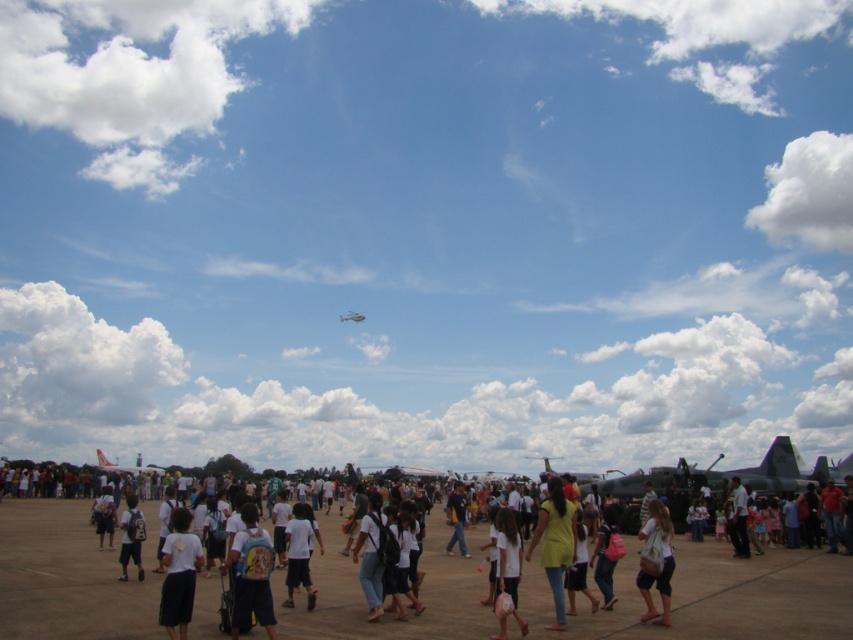
You are a photographer at the event and want to capture both the white matte skirt at lower center and the dark blue shirt at center in a single photo. Which clothing item will appear smaller in the photo?

The white matte skirt at lower center will appear smaller in the photo because it is not as tall as the dark blue shirt at center.